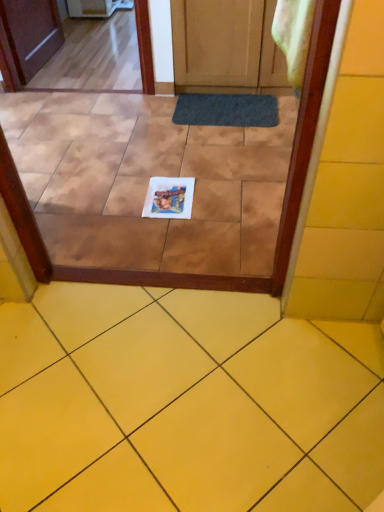
The height and width of the screenshot is (512, 384). In order to click on vacant area situated to the left side of dark gray rubber doormat at center in this screenshot , I will do `click(144, 120)`.